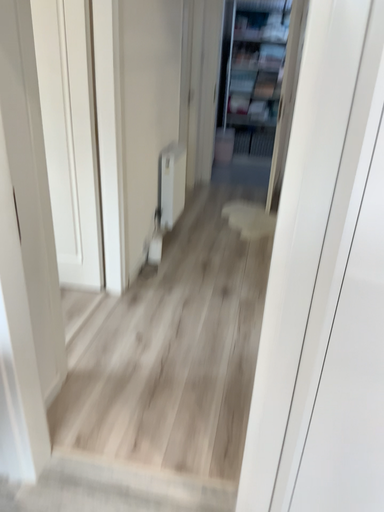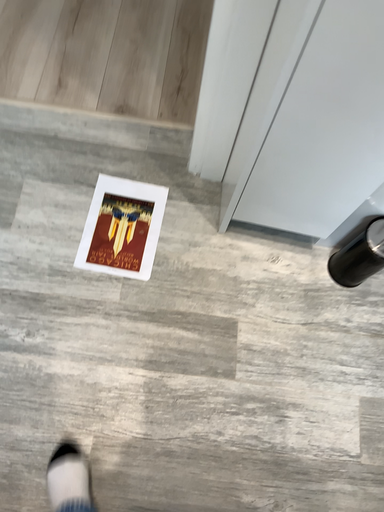
Question: How did the camera likely rotate when shooting the video?

Choices:
 (A) rotated upward
 (B) rotated downward

Answer: (B)